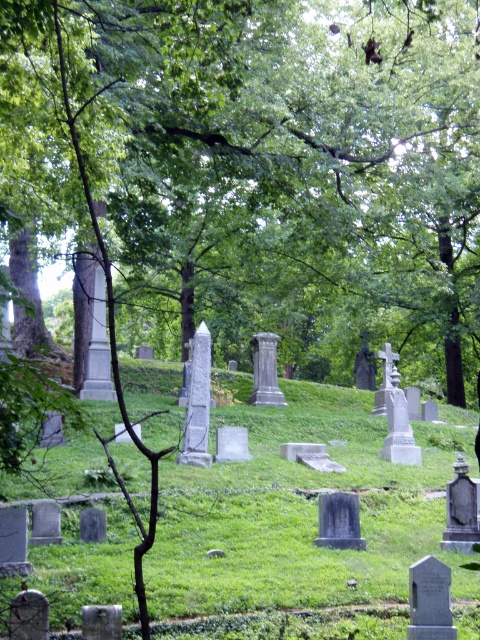
You are a landscape architect designing a walking path through the cemetery. You need to ensure the path is wide enough to accommodate two people walking side by side. The path will be placed between the green leafy tree at center and the green grassy hillside at center. Can the path between them be wide enough for two people to walk side by side?

The green leafy tree at center has a larger width than the green grassy hillside at center. Since the path is between them, the width of the path would depend on the space between their edges. However, since the tree is wider, it might take up more space, potentially leaving less room for the path. Without specific measurements of the distance between them, it is uncertain if the path can accommodate two people walking side by side.

You are standing at the entrance of the cemetery and want to walk towards the green grassy hillside at center. Which direction should you walk relative to the green leafy tree at center?

You should walk to the right of the green leafy tree at center because the green grassy hillside at center is located to the right of the green leafy tree at center.